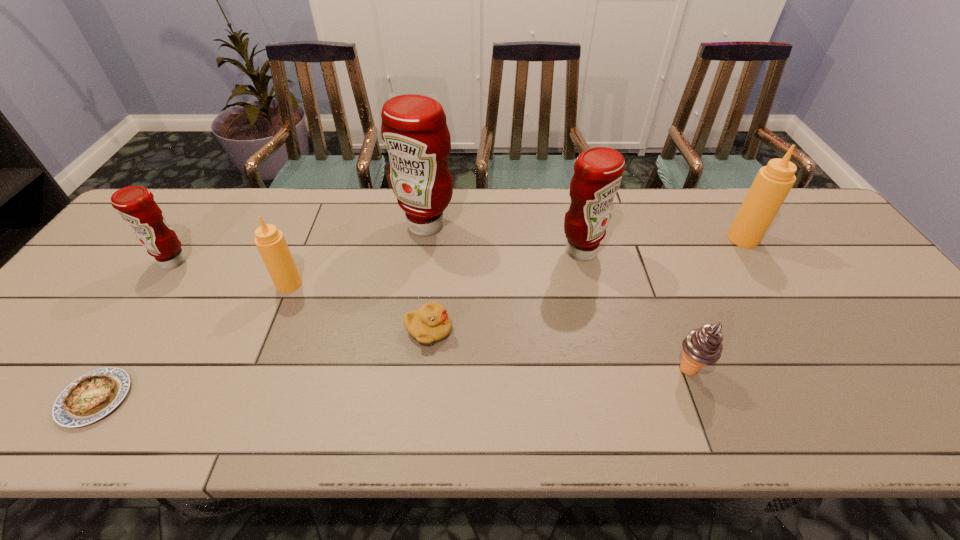
In order to click on the biggest red condiment in this screenshot , I will do `click(414, 131)`.

Where is `the third condiment from left to right`? Image resolution: width=960 pixels, height=540 pixels. the third condiment from left to right is located at coordinates (414, 131).

Where is `the bigger tan condiment`? the bigger tan condiment is located at coordinates (773, 182).

The height and width of the screenshot is (540, 960). In order to click on the farther tan condiment in this screenshot , I will do `click(773, 182)`.

What are the coordinates of `the second smallest red condiment` in the screenshot? It's located at tap(598, 171).

This screenshot has width=960, height=540. I want to click on the sixth object from left to right, so click(x=598, y=171).

Where is `the left tan condiment`? the left tan condiment is located at coordinates (270, 242).

What are the coordinates of `the smaller tan condiment` in the screenshot? It's located at (270, 242).

The width and height of the screenshot is (960, 540). In order to click on the leftmost red condiment in this screenshot , I will do `click(136, 205)`.

This screenshot has height=540, width=960. I want to click on the smallest red condiment, so click(136, 205).